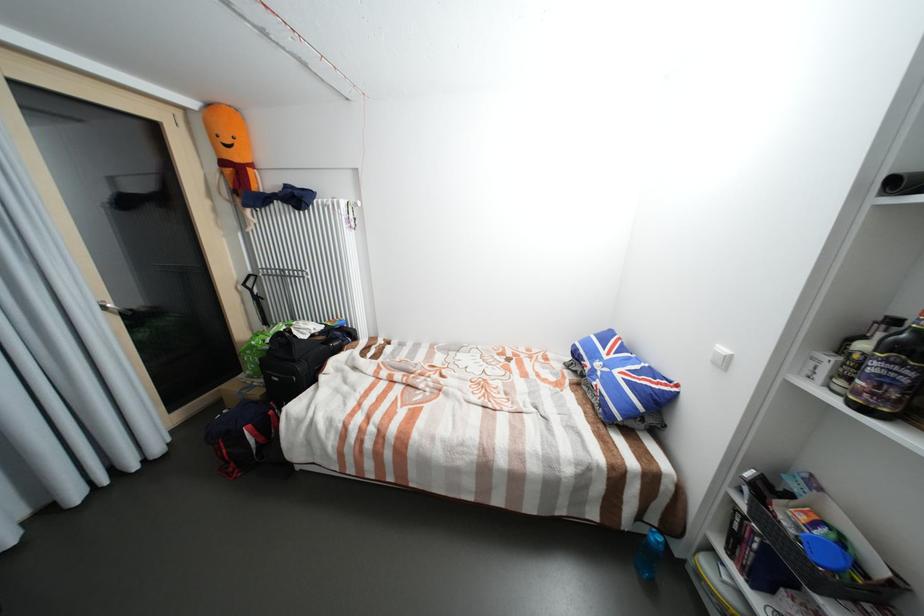
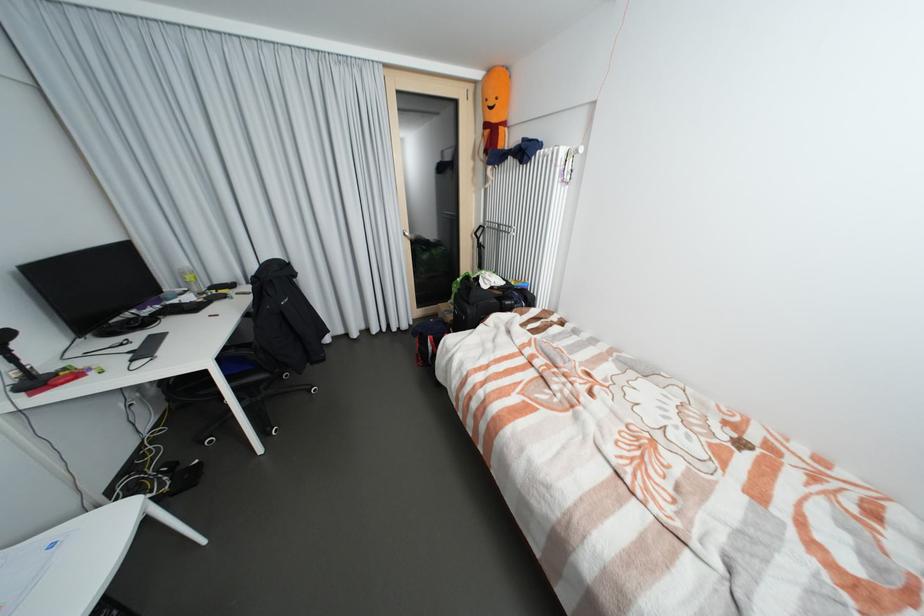
The point at (229, 163) is marked in the first image. Where is the corresponding point in the second image?

(492, 126)